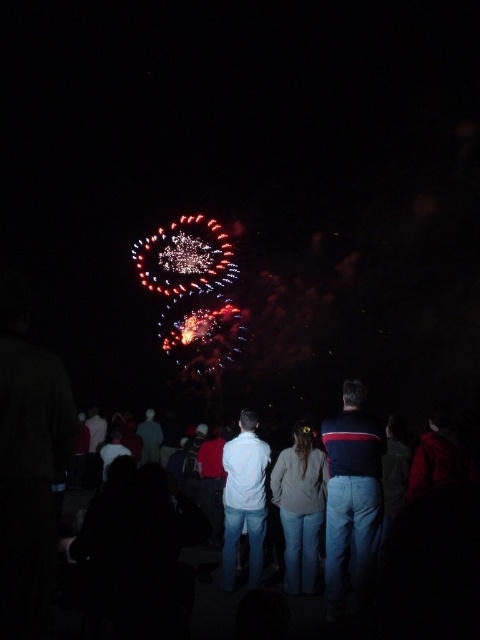
In the scene shown: Between jeans at center and denim jeans at center, which one is positioned higher?

Positioned higher is jeans at center.

Who is more forward, (x=407, y=609) or (x=305, y=544)?

Point (x=407, y=609)

Is point (344, 480) closer to viewer compared to point (303, 448)?

Yes, point (344, 480) is in front of point (303, 448).

Locate an element on the screen. The height and width of the screenshot is (640, 480). jeans at center is located at coordinates click(x=418, y=556).

Which of these two, denim jeans at center or white matte shirt at center, stands shorter?

With less height is denim jeans at center.

Who is positioned more to the right, denim jeans at center or white matte shirt at center?

Positioned to the right is denim jeans at center.

What do you see at coordinates (300, 508) in the screenshot? This screenshot has width=480, height=640. I see `denim jeans at center` at bounding box center [300, 508].

In order to click on denim jeans at center in this screenshot , I will do `click(300, 508)`.

Can you confirm if jeans at center is thinner than dark blue striped sweater at center?

Incorrect, jeans at center's width is not less than dark blue striped sweater at center's.

Who is shorter, jeans at center or dark blue striped sweater at center?

Standing shorter between the two is dark blue striped sweater at center.

Between point (459, 580) and point (370, 534), which one is positioned in front?

Positioned in front is point (459, 580).

Locate an element on the screen. The image size is (480, 640). jeans at center is located at coordinates (418, 556).